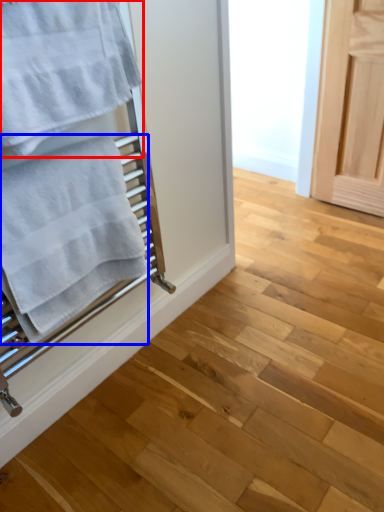
Question: Which object is further to the camera taking this photo, towel (highlighted by a red box) or towel (highlighted by a blue box)?

Choices:
 (A) towel
 (B) towel

Answer: (B)